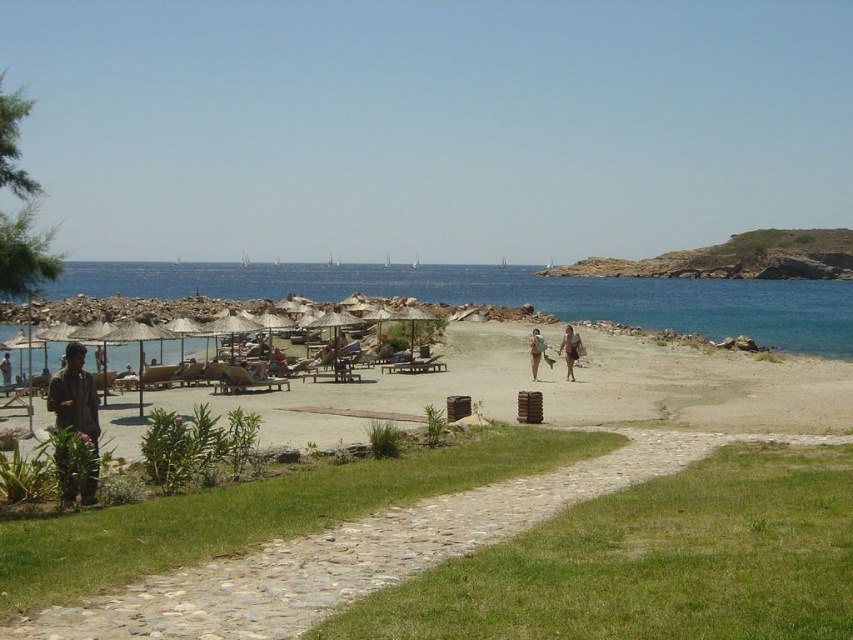
You are standing on the beach and see the green grass at lower center and the green fabric shirt at lower left. Which object takes up more space in the image?

The green grass at lower center takes up more space in the image than the green fabric shirt at lower left because it is bigger.

You are standing at the edge of the grassy area and want to place a brown leather jacket at lower left near the beige sand beach at lower left. Considering their heights, which one is taller?

The beige sand beach at lower left is taller than the brown leather jacket at lower left according to the description.